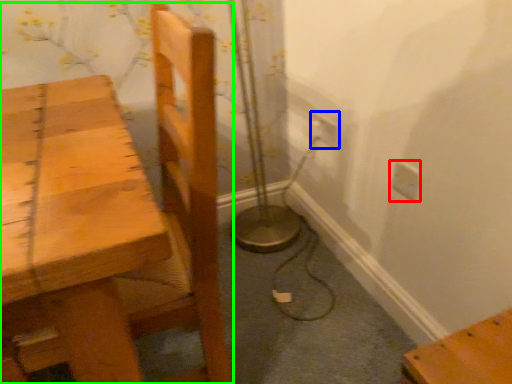
Question: Which is farther away from electric outlet (highlighted by a red box)? electric outlet (highlighted by a blue box) or chair (highlighted by a green box)?

Choices:
 (A) electric outlet
 (B) chair

Answer: (B)